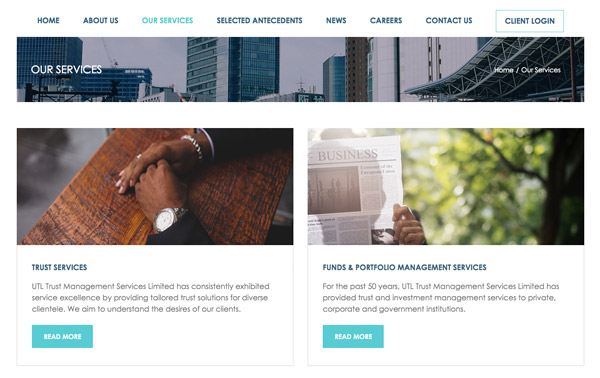
Where is `newspaper`? This screenshot has width=600, height=378. newspaper is located at coordinates (358, 168).